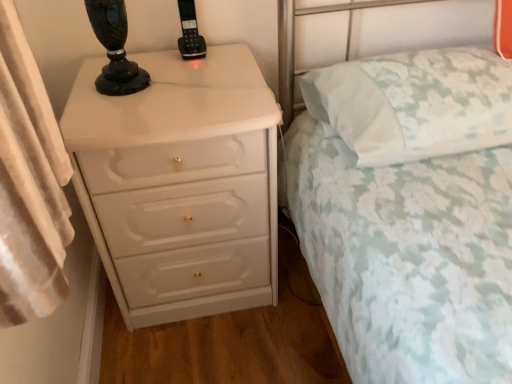
Question: From the image's perspective, relative to white floral fabric pillow at upper right, is black plastic phone at upper center above or below?

Choices:
 (A) above
 (B) below

Answer: (A)

Question: Does point (197, 24) appear closer or farther from the camera than point (373, 89)?

Choices:
 (A) farther
 (B) closer

Answer: (A)

Question: Which object is positioned farthest from the black plastic phone at upper center?

Choices:
 (A) white floral fabric bed at center
 (B) white glossy chest of drawers at left
 (C) white floral fabric pillow at upper right

Answer: (A)

Question: Based on their relative distances, which object is farther from the white floral fabric bed at center?

Choices:
 (A) black plastic phone at upper center
 (B) white glossy chest of drawers at left
 (C) white floral fabric pillow at upper right

Answer: (A)